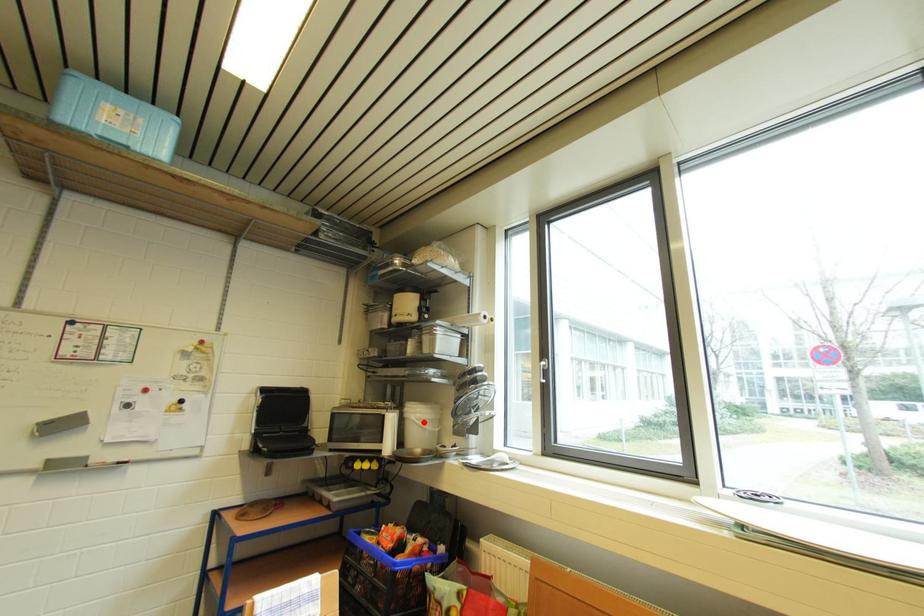
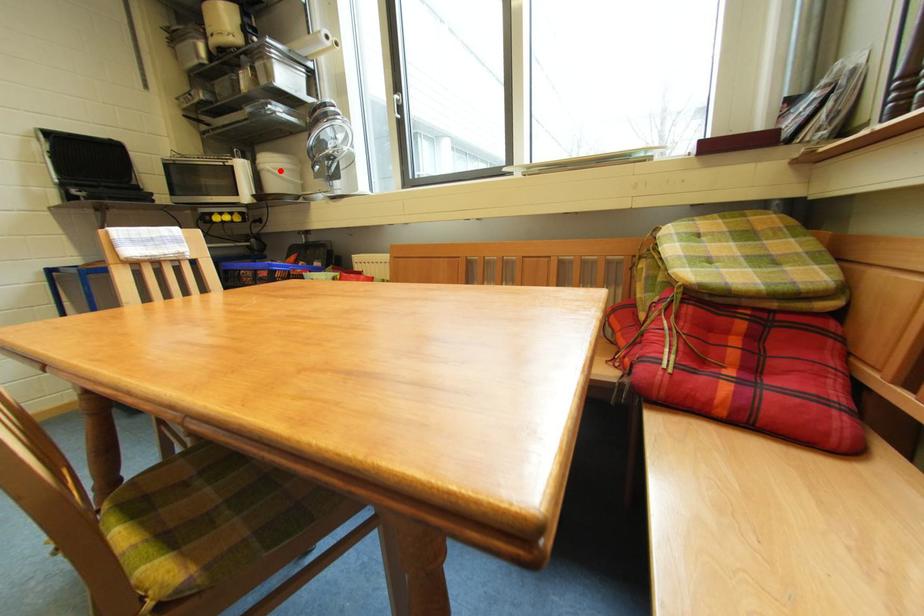
I am providing you with two images of the same scene from different viewpoints. A red point is marked on the first image and another point is marked on the second image. Does the point marked in image1 correspond to the same location as the one in image2?

Yes